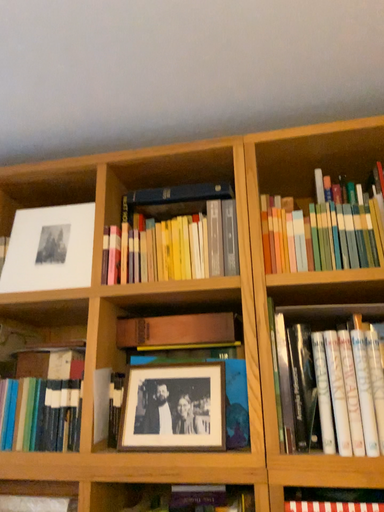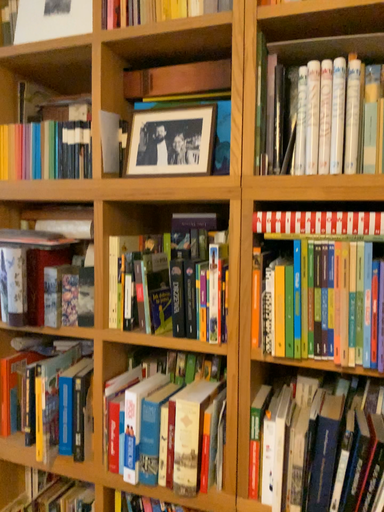
Question: Which way did the camera rotate in the video?

Choices:
 (A) rotated right
 (B) rotated left

Answer: (B)